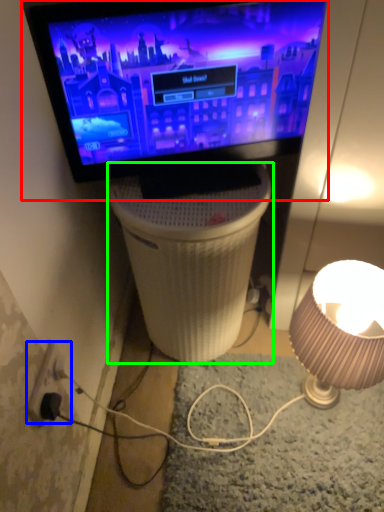
Question: Considering the real-world distances, which object is farthest from television (highlighted by a red box)? electric outlet (highlighted by a blue box) or table (highlighted by a green box)?

Choices:
 (A) electric outlet
 (B) table

Answer: (A)